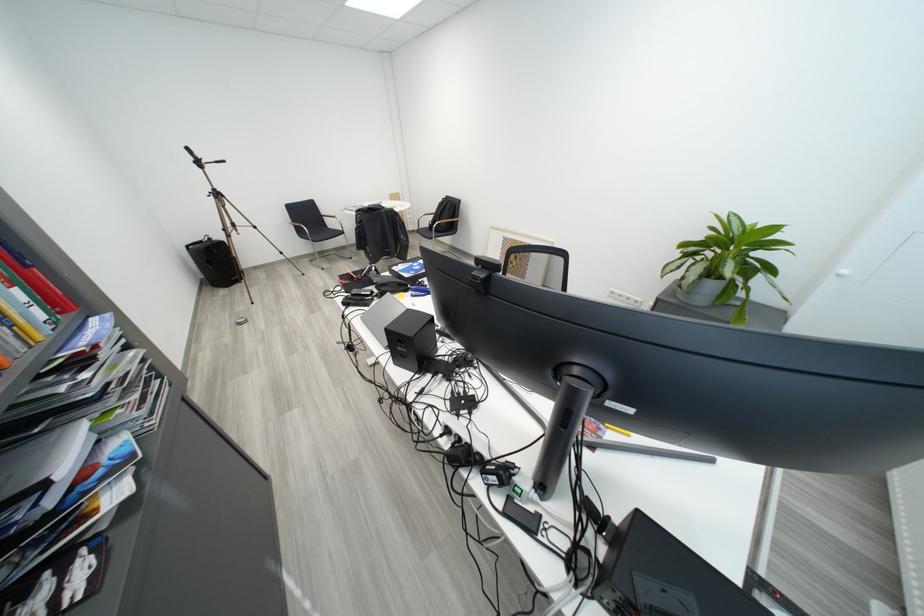
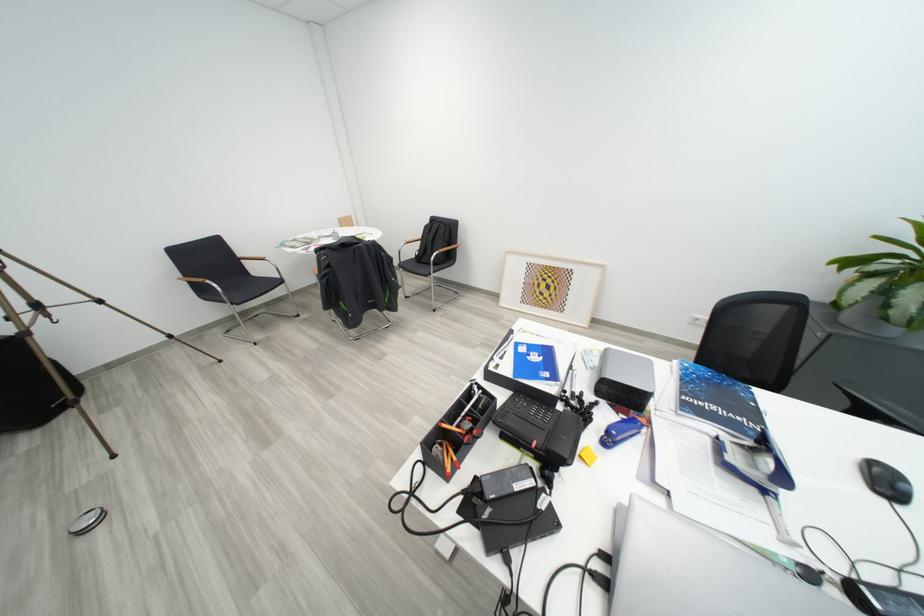
In the second image, find the point that corresponds to point (338, 229) in the first image.

(262, 276)